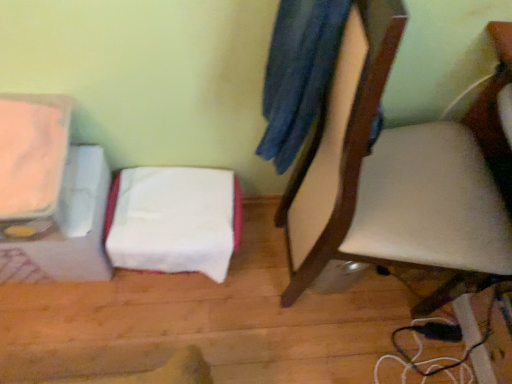
Question: Is white fabric at lower left outside matte orange toaster at left?

Choices:
 (A) yes
 (B) no

Answer: (A)

Question: Can you see white fabric at lower left touching matte orange toaster at left?

Choices:
 (A) no
 (B) yes

Answer: (A)

Question: Does white fabric at lower left appear on the left side of matte orange toaster at left?

Choices:
 (A) yes
 (B) no

Answer: (B)

Question: Is matte orange toaster at left completely or partially inside white fabric at lower left?

Choices:
 (A) yes
 (B) no

Answer: (B)

Question: Is white fabric at lower left facing towards matte orange toaster at left?

Choices:
 (A) yes
 (B) no

Answer: (B)

Question: Based on their positions, is matte orange toaster at left located to the left or right of white fabric at lower left?

Choices:
 (A) left
 (B) right

Answer: (A)

Question: Considering the positions of matte orange toaster at left and white fabric at lower left in the image, is matte orange toaster at left wider or thinner than white fabric at lower left?

Choices:
 (A) thin
 (B) wide

Answer: (B)

Question: From the image's perspective, is matte orange toaster at left located above or below white fabric at lower left?

Choices:
 (A) above
 (B) below

Answer: (A)

Question: Considering their positions, is matte orange toaster at left located in front of or behind white fabric at lower left?

Choices:
 (A) behind
 (B) front

Answer: (B)

Question: Is point (212, 208) positioned closer to the camera than point (413, 256)?

Choices:
 (A) closer
 (B) farther

Answer: (B)

Question: Considering the positions of white fabric at lower left and white leather chair at center in the image, is white fabric at lower left taller or shorter than white leather chair at center?

Choices:
 (A) tall
 (B) short

Answer: (B)

Question: Considering the positions of white fabric at lower left and white leather chair at center in the image, is white fabric at lower left wider or thinner than white leather chair at center?

Choices:
 (A) thin
 (B) wide

Answer: (A)

Question: Based on their sizes in the image, would you say white fabric at lower left is bigger or smaller than white leather chair at center?

Choices:
 (A) small
 (B) big

Answer: (A)

Question: Considering the positions of point (453, 251) and point (82, 268), is point (453, 251) closer or farther from the camera than point (82, 268)?

Choices:
 (A) closer
 (B) farther

Answer: (A)

Question: Is white leather chair at center taller or shorter than matte orange toaster at left?

Choices:
 (A) short
 (B) tall

Answer: (B)